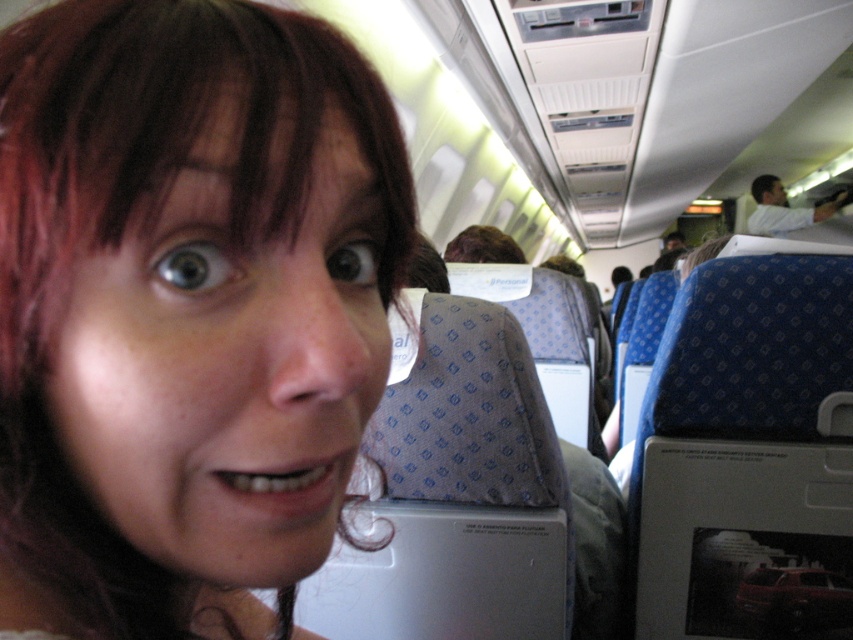
Question: Which object is the farthest from the matte white shirt at upper right?

Choices:
 (A) matte skin face at center
 (B) brown fuzzy hair at center

Answer: (A)

Question: Considering the real-world distances, which object is farthest from the matte skin face at center?

Choices:
 (A) matte white shirt at upper right
 (B) brown fuzzy hair at center

Answer: (A)

Question: Is matte skin face at center positioned behind brown fuzzy hair at center?

Choices:
 (A) yes
 (B) no

Answer: (B)

Question: Is matte white shirt at upper right positioned in front of brown fuzzy hair at center?

Choices:
 (A) yes
 (B) no

Answer: (B)

Question: Which object is the closest to the matte white shirt at upper right?

Choices:
 (A) matte skin face at center
 (B) brown fuzzy hair at center

Answer: (B)

Question: Does matte white shirt at upper right have a greater width compared to brown fuzzy hair at center?

Choices:
 (A) no
 (B) yes

Answer: (B)